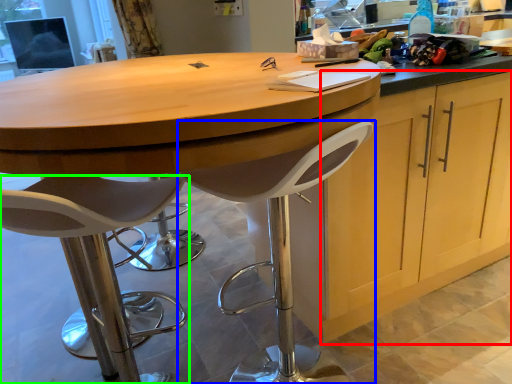
Question: Which object is the farthest from cabinetry (highlighted by a red box)? Choose among these: chair (highlighted by a blue box) or chair (highlighted by a green box).

Choices:
 (A) chair
 (B) chair

Answer: (B)